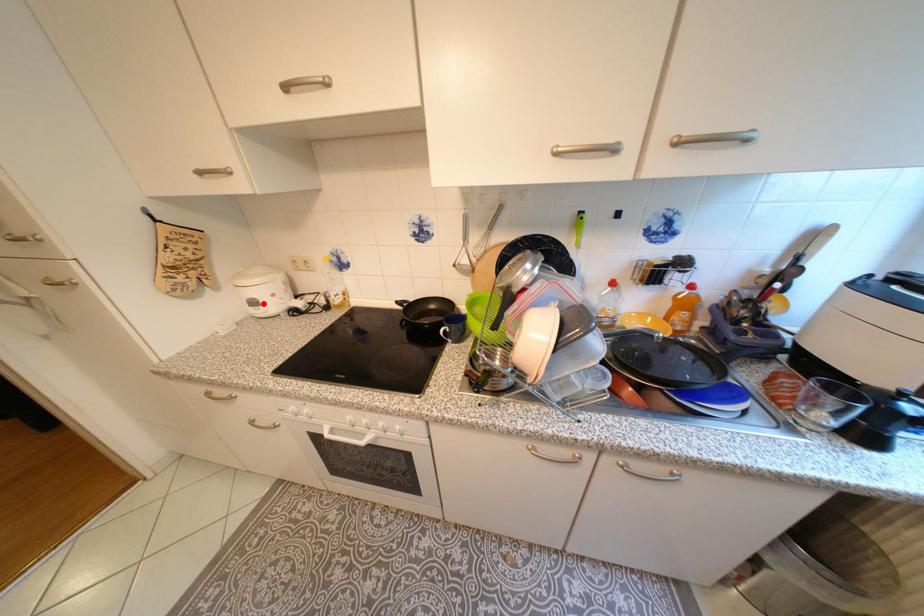
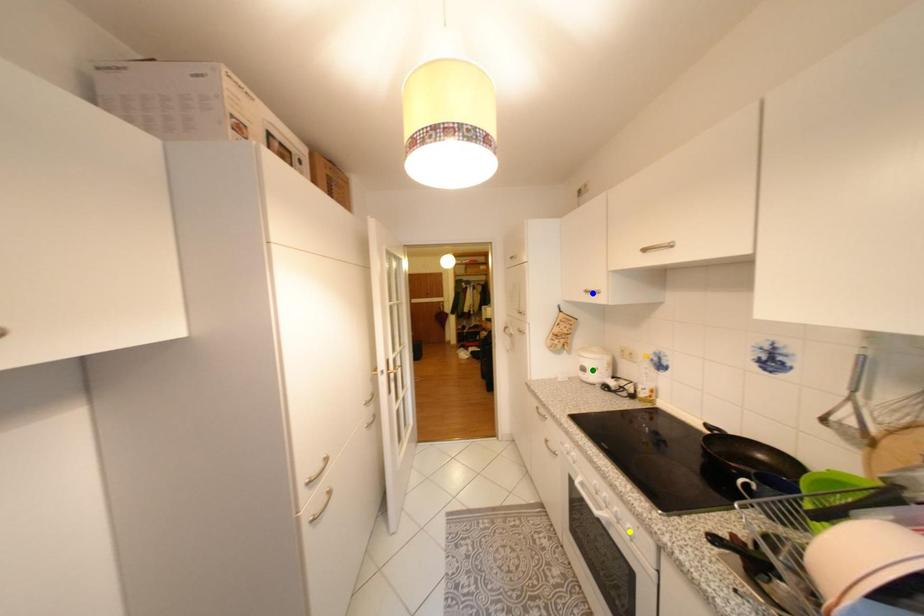
Question: I am providing you with two images of the same scene from different viewpoints. A red point is marked on the first image. You are given multiple points on the second image. In image 2, which mark is for the same physical point as the one in image 1?

Choices:
 (A) blue point
 (B) yellow point
 (C) green point

Answer: (C)